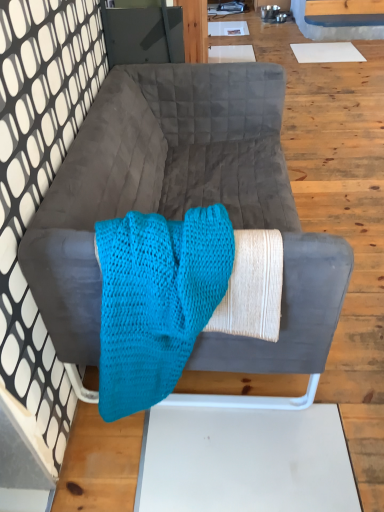
Question: From a real-world perspective, is velvet gray couch at center above or below turquoise knitted blanket at center?

Choices:
 (A) below
 (B) above

Answer: (A)

Question: Looking at their shapes, would you say velvet gray couch at center is wider or thinner than turquoise knitted blanket at center?

Choices:
 (A) wide
 (B) thin

Answer: (A)

Question: Is velvet gray couch at center taller or shorter than turquoise knitted blanket at center?

Choices:
 (A) tall
 (B) short

Answer: (A)

Question: From the image's perspective, relative to velvet gray couch at center, is turquoise knitted blanket at center above or below?

Choices:
 (A) below
 (B) above

Answer: (A)

Question: Would you say turquoise knitted blanket at center is to the left or to the right of velvet gray couch at center in the picture?

Choices:
 (A) left
 (B) right

Answer: (A)

Question: Is turquoise knitted blanket at center spatially inside velvet gray couch at center, or outside of it?

Choices:
 (A) outside
 (B) inside

Answer: (B)

Question: In the image, is turquoise knitted blanket at center positioned in front of or behind velvet gray couch at center?

Choices:
 (A) behind
 (B) front

Answer: (B)